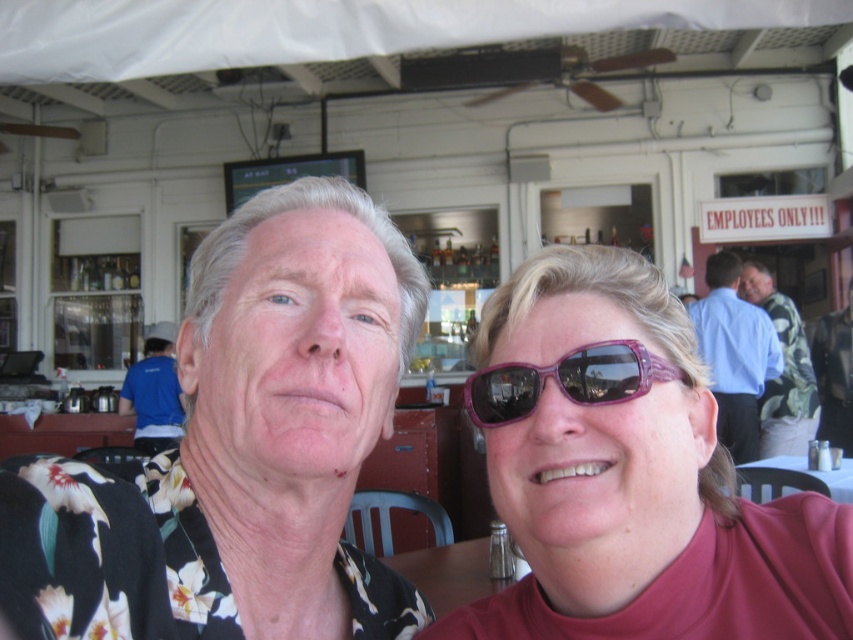
Is green leafy shirt at right closer to the viewer compared to white plastic table at lower center?

No, green leafy shirt at right is behind white plastic table at lower center.

Based on the photo, measure the distance between point [804,339] and camera.

4.92 meters

Locate an element on the screen. The height and width of the screenshot is (640, 853). green leafy shirt at right is located at coordinates (782, 369).

Which is below, purple shiny sunglasses at center or blue shirt at left?

blue shirt at left

Is purple shiny sunglasses at center wider than blue shirt at left?

Incorrect, purple shiny sunglasses at center's width does not surpass blue shirt at left's.

Does point (614, 524) lie in front of point (138, 360)?

Yes, it is in front of point (138, 360).

Identify the location of purple shiny sunglasses at center. (630, 474).

Is floral shirt at left smaller than blue shirt at right?

Indeed, floral shirt at left has a smaller size compared to blue shirt at right.

Based on the photo, who is more forward, (234,237) or (764,333)?

Point (234,237) is more forward.

At what (x,y) coordinates should I click in order to perform the action: click on floral shirt at left. Please return your answer as a coordinate pair (x, y). This screenshot has width=853, height=640. Looking at the image, I should click on (239, 449).